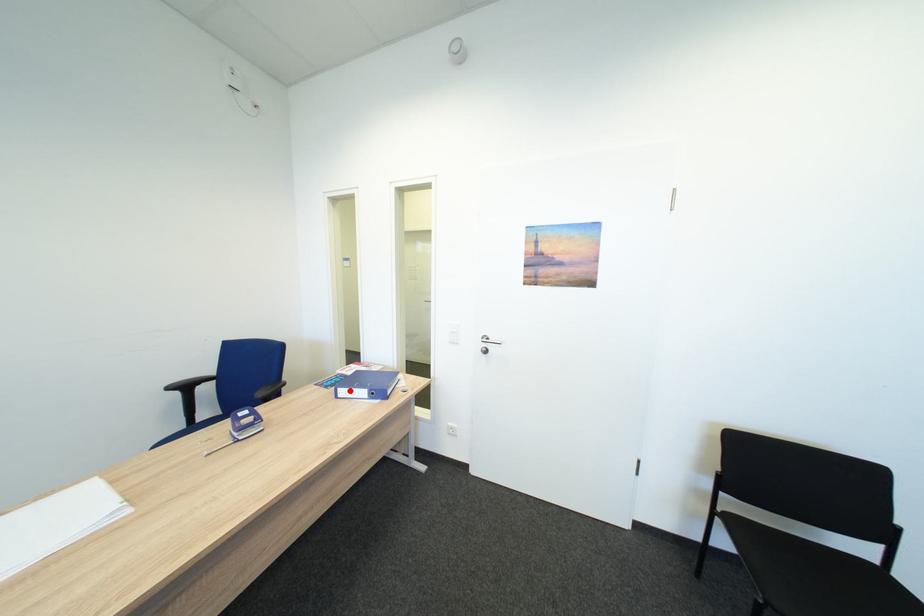
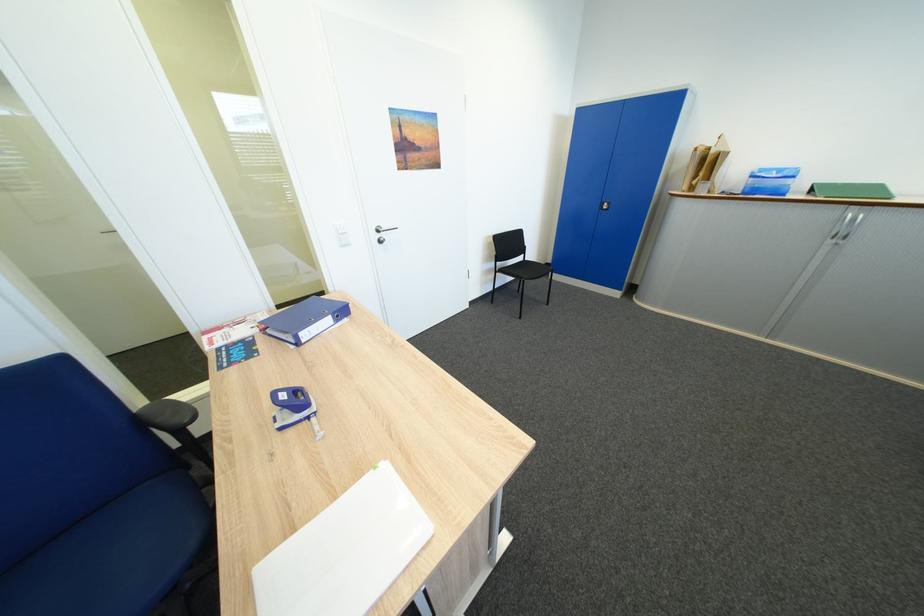
In the second image, find the point that corresponds to the highlighted location in the first image.

(310, 334)